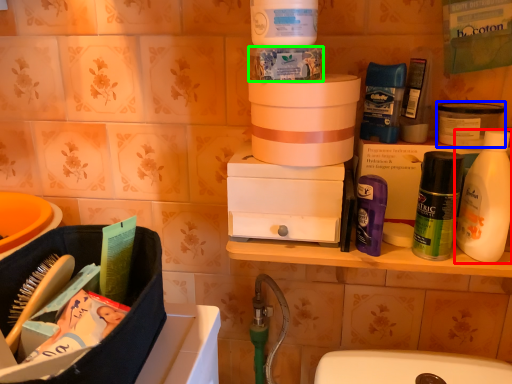
Question: Estimate the real-world distances between objects in this image. Which object is farther from bottle (highlighted by a red box), product (highlighted by a blue box) or product (highlighted by a green box)?

Choices:
 (A) product
 (B) product

Answer: (B)